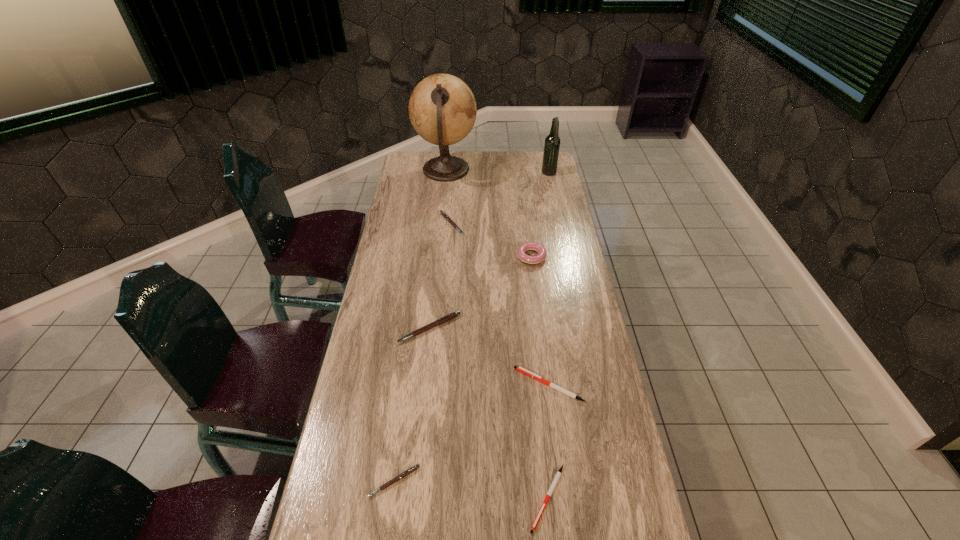
Find the location of a particular element. The width and height of the screenshot is (960, 540). free space located 0.090m on the clicker of the third nearest pen is located at coordinates (483, 385).

Where is `globe present at the far edge`? Image resolution: width=960 pixels, height=540 pixels. globe present at the far edge is located at coordinates (442, 109).

Where is `beer bottle that is positioned at the far edge`? beer bottle that is positioned at the far edge is located at coordinates (552, 142).

This screenshot has width=960, height=540. Identify the location of globe present at the left edge. (442, 109).

Where is `beer bottle that is at the right edge`? beer bottle that is at the right edge is located at coordinates (552, 142).

The height and width of the screenshot is (540, 960). I want to click on doughnut at the right edge, so click(x=529, y=246).

This screenshot has width=960, height=540. Identify the location of pen that is at the right edge. (520, 369).

Find the location of a particular element. This screenshot has height=540, width=960. object present at the far left corner is located at coordinates (442, 109).

Locate an element on the screen. The image size is (960, 540). object present at the far right corner is located at coordinates (552, 142).

What are the coordinates of `blank space at the left edge of the desktop` in the screenshot? It's located at (392, 471).